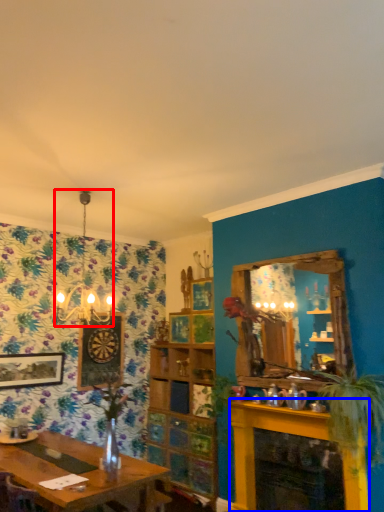
Question: Which object is further to the camera taking this photo, light fixture (highlighted by a red box) or fireplace (highlighted by a blue box)?

Choices:
 (A) light fixture
 (B) fireplace

Answer: (A)